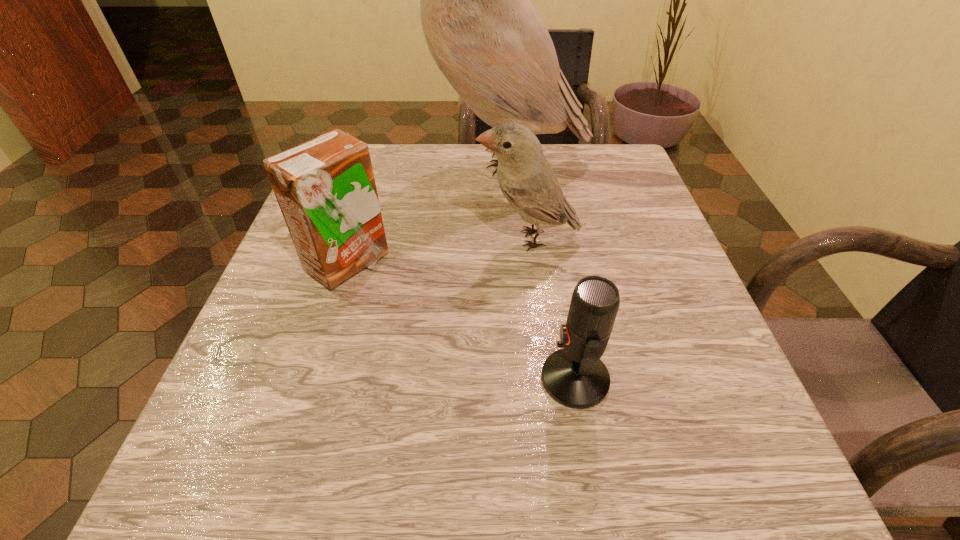
Where is `vacant point located between the bird and the carton`? This screenshot has width=960, height=540. vacant point located between the bird and the carton is located at coordinates (438, 252).

Locate an element on the screen. The height and width of the screenshot is (540, 960). vacant space that is in between the tallest object and the microphone is located at coordinates (537, 269).

Locate an element on the screen. The height and width of the screenshot is (540, 960). free spot between the carton and the bird is located at coordinates (438, 252).

Locate an element on the screen. free area in between the bird and the microphone is located at coordinates (551, 309).

I want to click on object that can be found as the third closest to the carton, so click(x=574, y=376).

Image resolution: width=960 pixels, height=540 pixels. What are the coordinates of `object that stands as the third closest to the bird` in the screenshot? It's located at click(574, 376).